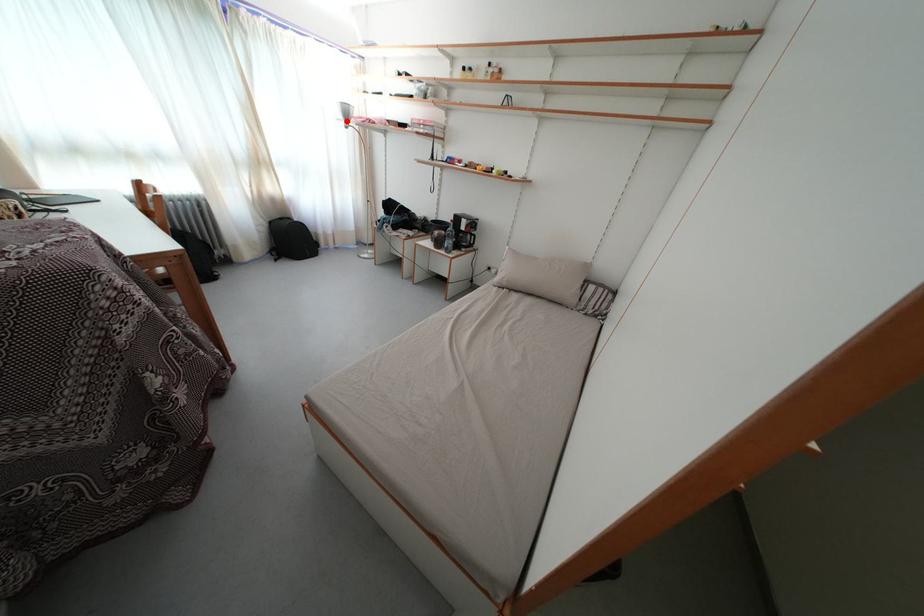
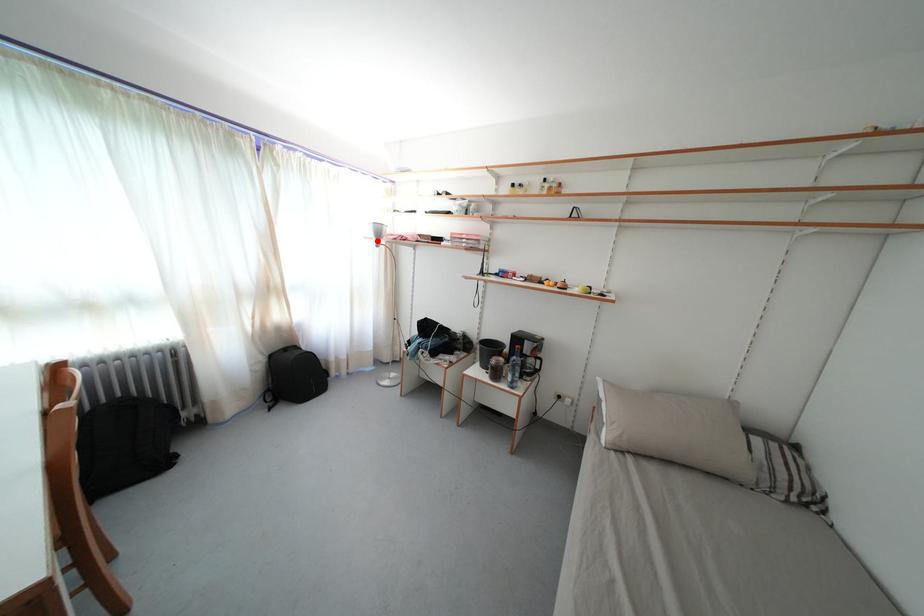
I am providing you with two images of the same scene from different viewpoints. A red point is marked on the first image and another point is marked on the second image. Do the highlighted points in image1 and image2 indicate the same real-world spot?

Yes